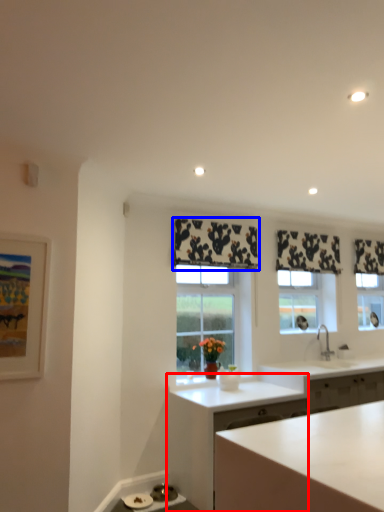
Question: Which point is further to the camera, cabinetry (highlighted by a red box) or curtain (highlighted by a blue box)?

Choices:
 (A) cabinetry
 (B) curtain

Answer: (B)